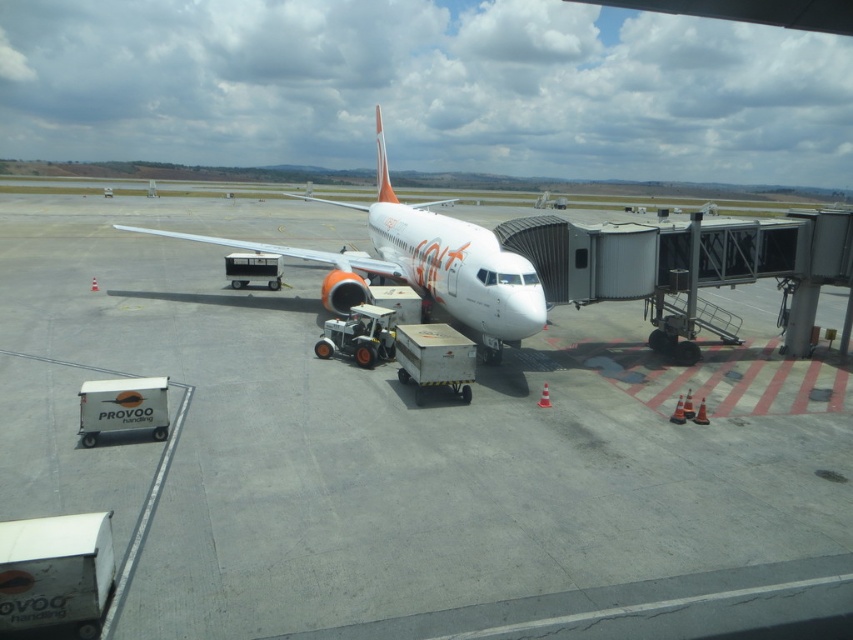
You are standing at the point marked as point (401,448) in the image. What material are you standing on?

The point (401,448) is on the white smooth tarmac at center.

You are a maintenance worker standing on the white smooth tarmac at center. You need to reach the white glossy airplane at center for inspection. Given that your reach extends 3 feet, can you touch the airplane without moving from your current position?

The distance between the white smooth tarmac at center and the white glossy airplane at center is 10.85 feet. Since your reach extends only 3 feet, you cannot touch the airplane without moving closer.